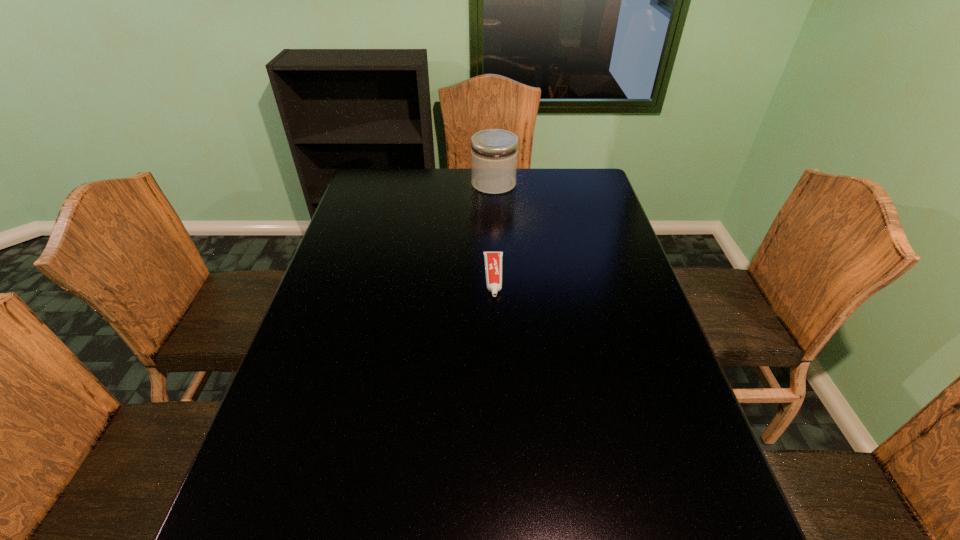
Locate an element on the screen. The height and width of the screenshot is (540, 960). vacant space at the far left corner is located at coordinates (388, 170).

Identify the location of vacant space at the far right corner. The image size is (960, 540). point(591,171).